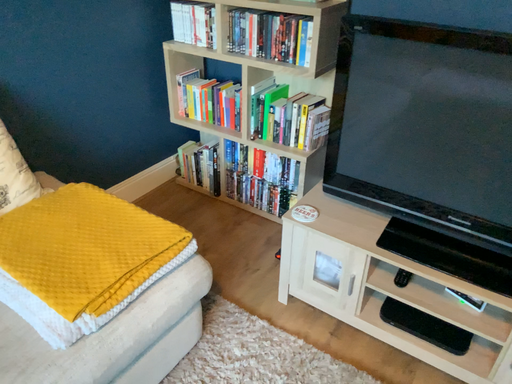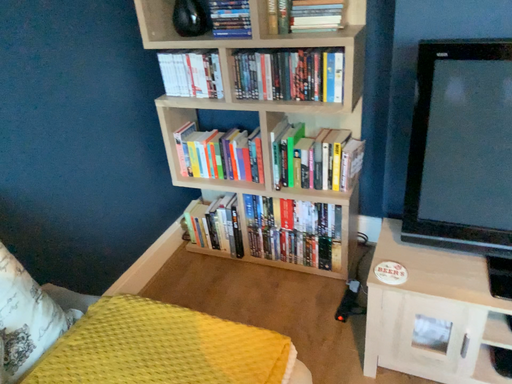
Question: Which way did the camera rotate in the video?

Choices:
 (A) rotated right
 (B) rotated left

Answer: (A)